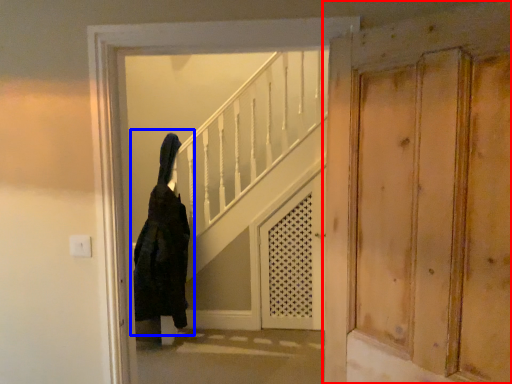
Question: Among these objects, which one is farthest to the camera, door (highlighted by a red box) or woman (highlighted by a blue box)?

Choices:
 (A) door
 (B) woman

Answer: (B)